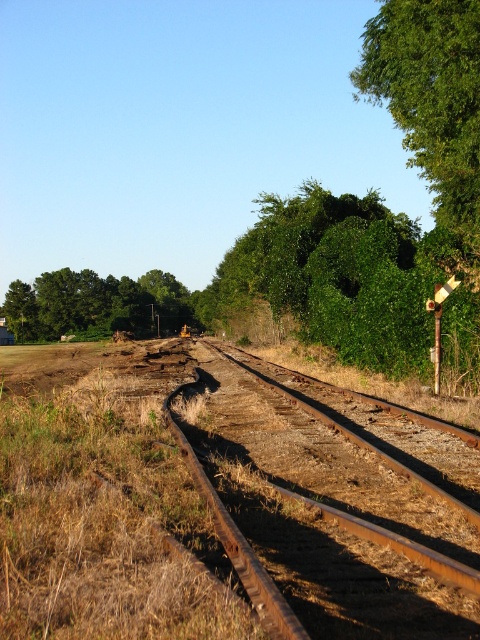
In the scene shown: You are a painter setting up an easel to paint the scene. You want to capture the green leafy tree at upper left and the rusty metal pole at right in your painting. Which object should you position wider in your painting?

The green leafy tree at upper left might be wider than the rusty metal pole at right, so you should position the green leafy tree at upper left wider in your painting.

You are a railway inspector checking the condition of tracks and poles. You notice the rusty metal train track at center and the rusty metal pole at right. Which object is wider?

The rusty metal train track at center is wider than the rusty metal pole at right.